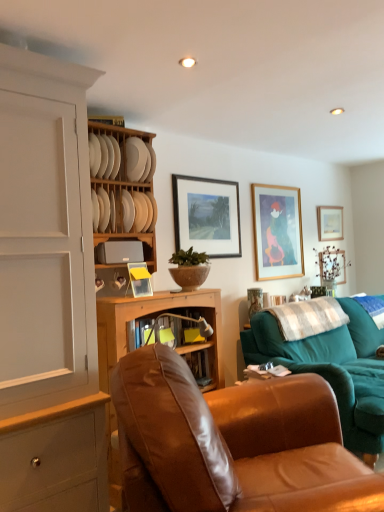
Question: Is brown leather chair at center taller than matte gray toaster at center, the 1th shelf positioned from the bottom?

Choices:
 (A) no
 (B) yes

Answer: (B)

Question: Does brown leather chair at center have a smaller size compared to matte gray toaster at center, the second shelf when ordered from top to bottom?

Choices:
 (A) yes
 (B) no

Answer: (B)

Question: Does brown leather chair at center have a lesser height compared to matte gray toaster at center, the second shelf when ordered from top to bottom?

Choices:
 (A) no
 (B) yes

Answer: (A)

Question: From the image's perspective, is brown leather chair at center on top of matte gray toaster at center, the 1th shelf positioned from the bottom?

Choices:
 (A) no
 (B) yes

Answer: (A)

Question: Is brown leather chair at center positioned beyond the bounds of matte gray toaster at center, the 1th shelf positioned from the bottom?

Choices:
 (A) yes
 (B) no

Answer: (A)

Question: From a real-world perspective, is brown leather chair at center beneath matte gray toaster at center, the 1th shelf positioned from the bottom?

Choices:
 (A) yes
 (B) no

Answer: (A)

Question: From a real-world perspective, is white matte plate at upper center, acting as the 2th plate starting from the top, positioned over white painted wood cabinet at left based on gravity?

Choices:
 (A) yes
 (B) no

Answer: (A)

Question: Can you confirm if white matte plate at upper center, acting as the 2th plate starting from the top, is taller than white painted wood cabinet at left?

Choices:
 (A) no
 (B) yes

Answer: (A)

Question: Is the depth of white matte plate at upper center, the 1th plate in the bottom-to-top sequence, greater than that of white painted wood cabinet at left?

Choices:
 (A) no
 (B) yes

Answer: (B)

Question: Is white matte plate at upper center, acting as the 2th plate starting from the top, at the right side of white painted wood cabinet at left?

Choices:
 (A) no
 (B) yes

Answer: (B)

Question: Does white matte plate at upper center, the 1th plate in the bottom-to-top sequence, have a lesser height compared to white painted wood cabinet at left?

Choices:
 (A) yes
 (B) no

Answer: (A)

Question: Does white matte plate at upper center, the 1th plate in the bottom-to-top sequence, turn towards white painted wood cabinet at left?

Choices:
 (A) no
 (B) yes

Answer: (A)

Question: From a real-world perspective, is wooden picture frame at upper right, the 1th picture frame from the right, on top of teal fabric couch at right?

Choices:
 (A) no
 (B) yes

Answer: (B)